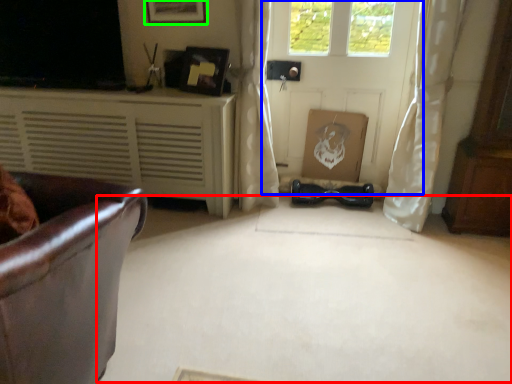
Question: Which object is the farthest from plain (highlighted by a red box)? Choose among these: door (highlighted by a blue box) or picture frame (highlighted by a green box).

Choices:
 (A) door
 (B) picture frame

Answer: (B)